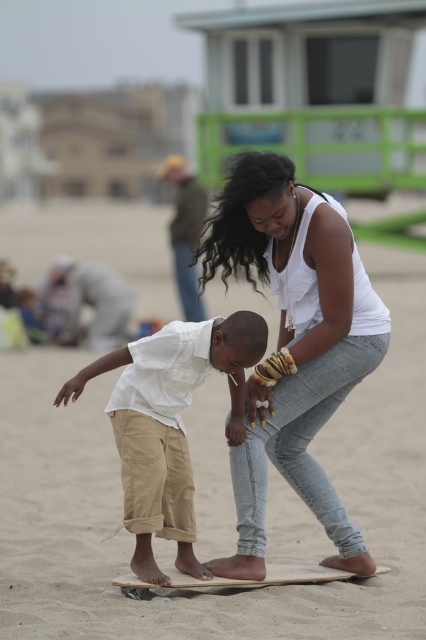
Question: Estimate the real-world distances between objects in this image. Which object is farther from the beige sand at center?

Choices:
 (A) white cotton shirt at center
 (B) white matte tank top at center

Answer: (A)

Question: Which is farther from the beige sand at center?

Choices:
 (A) wooden skateboard at center
 (B) white cotton shirt at center

Answer: (A)

Question: Is beige sand at center to the left of white matte tank top at center from the viewer's perspective?

Choices:
 (A) no
 (B) yes

Answer: (B)

Question: Is beige sand at center positioned behind white cotton shirt at center?

Choices:
 (A) no
 (B) yes

Answer: (A)

Question: Is white matte tank top at center wider than white cotton shirt at center?

Choices:
 (A) yes
 (B) no

Answer: (B)

Question: Among these points, which one is farthest from the camera?

Choices:
 (A) (71, 477)
 (B) (287, 216)

Answer: (A)